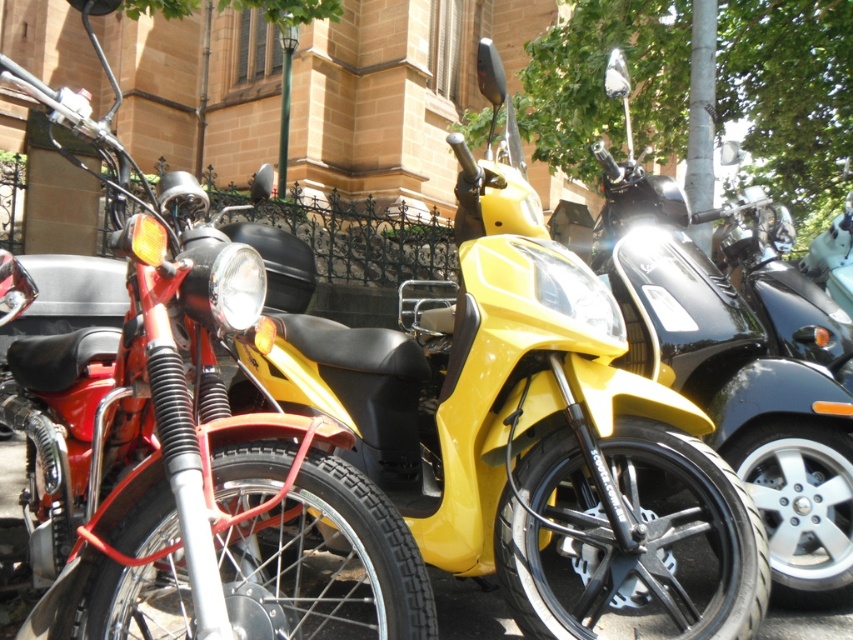
You are standing in front of the parked vehicles and want to know how far the point at coordinates (488,545) is from you. Can you determine the distance?

The point at coordinates (488,545) is 7.05 feet away from you.

You are a delivery person who needs to park your 1.8 meters wide delivery cart between the matte black motorcycle at left and the shiny black scooter at center. Can you fit your cart between them without touching either vehicle?

The matte black motorcycle at left is wider than the shiny black scooter at center. Therefore, the space between them may not be sufficient to fit a 1.8 meters wide delivery cart without touching either vehicle.